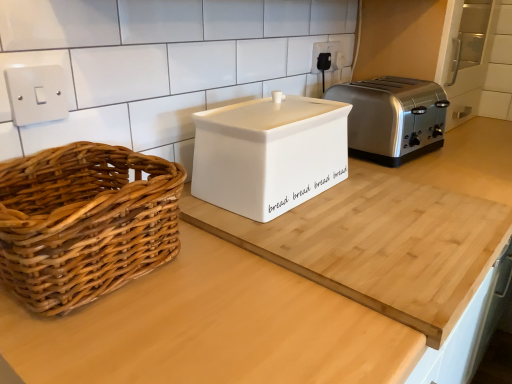
Question: Relative to white plastic electrical outlet at upper center, is white matte bread bin at center in front or behind?

Choices:
 (A) behind
 (B) front

Answer: (B)

Question: Is white matte bread bin at center taller or shorter than white plastic electrical outlet at upper center?

Choices:
 (A) tall
 (B) short

Answer: (A)

Question: Estimate the real-world distances between objects in this image. Which object is farther from the white matte bread bin at center?

Choices:
 (A) woven wood picnic basket at left
 (B) white plastic electrical outlet at upper center
 (C) white ceramic bread bin at center
 (D) satin silver toaster at right

Answer: (B)

Question: Which object is the closest to the white ceramic bread bin at center?

Choices:
 (A) woven wood picnic basket at left
 (B) satin silver toaster at right
 (C) white plastic electrical outlet at upper center
 (D) white matte bread bin at center

Answer: (D)